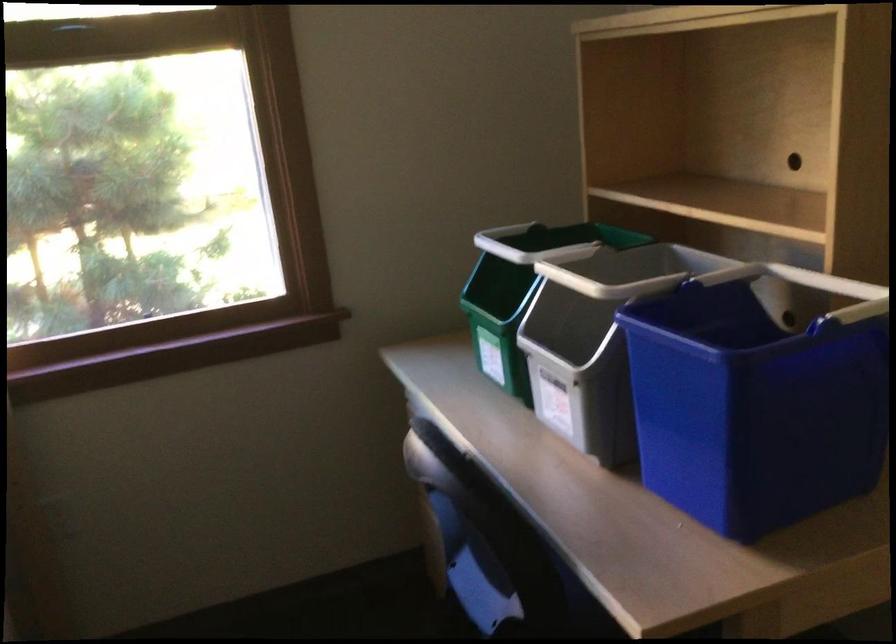
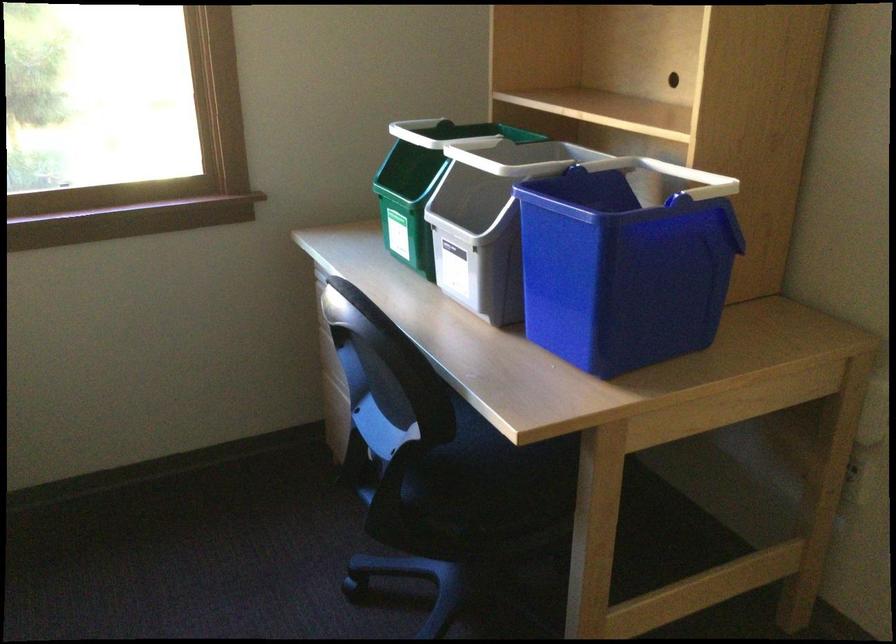
Question: I am providing you with two images of the same scene from different viewpoints. After the viewpoint changes to image2, which objects are now occluded?

Choices:
 (A) green recycling bin
 (B) grey recycling bin
 (C) blue bin handle
 (D) laundry hamper handle

Answer: (C)